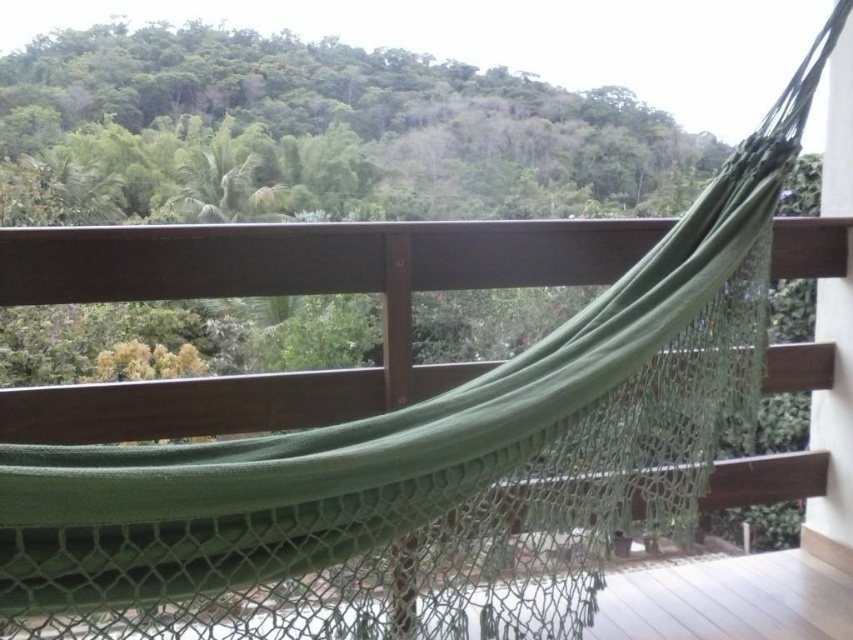
Between green fabric hammock at center and green mesh hammock at center, which one is positioned higher?

green fabric hammock at center is above.

Does green fabric hammock at center appear under green mesh hammock at center?

Actually, green fabric hammock at center is above green mesh hammock at center.

Which is in front, point (370, 268) or point (809, 605)?

Point (370, 268) is in front.

At what (x,y) coordinates should I click in order to perform the action: click on green fabric hammock at center. Please return your answer as a coordinate pair (x, y). This screenshot has width=853, height=640. Looking at the image, I should click on (281, 289).

Does green leafy tree at upper center appear over green fabric hammock at center?

Yes.

Is green leafy tree at upper center shorter than green fabric hammock at center?

In fact, green leafy tree at upper center may be taller than green fabric hammock at center.

Between point (314, 109) and point (635, 252), which one is positioned behind?

Positioned behind is point (314, 109).

Locate an element on the screen. The image size is (853, 640). green leafy tree at upper center is located at coordinates pos(321,132).

Is green leafy tree at upper center further to the viewer compared to green mesh hammock at center?

Yes, green leafy tree at upper center is behind green mesh hammock at center.

Can you confirm if green leafy tree at upper center is bigger than green mesh hammock at center?

Yes.

Is point (67, 147) farther from viewer compared to point (744, 604)?

Yes.

You are a GUI agent. You are given a task and a screenshot of the screen. Output one action in this format:
    pyautogui.click(x=<x>, y=<y>)
    Task: Click on the green leafy tree at upper center
    The image size is (853, 640).
    Given the screenshot: What is the action you would take?
    pyautogui.click(x=321, y=132)